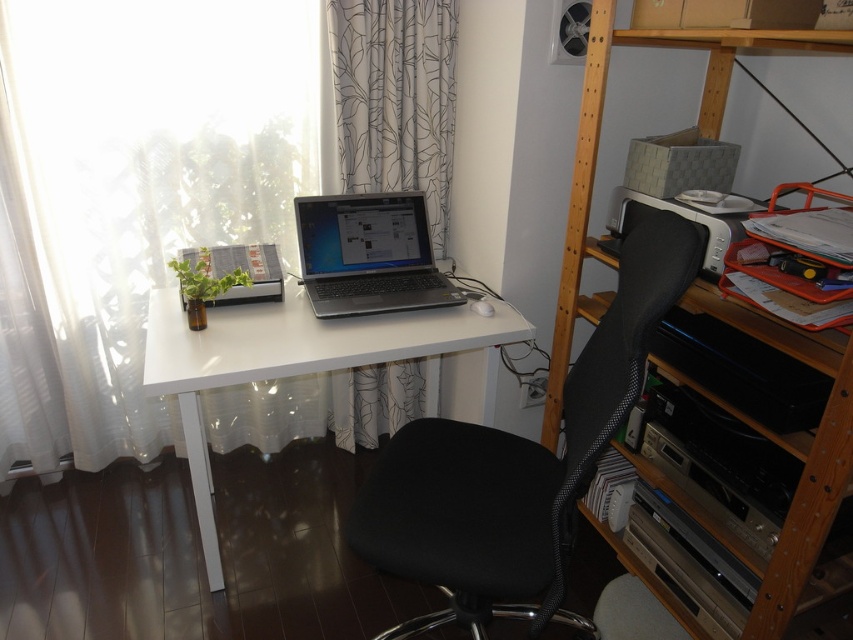
You are sitting in the black fabric swivel chair at center and want to reach the satin black laptop at center. Can you easily reach it without moving your chair?

The black fabric swivel chair at center is in front of the satin black laptop at center, so you can easily reach the laptop by leaning forward or swiveling slightly without needing to move the chair.

You are setting up a new desk in your home office. You have a black fabric swivel chair at center and a satin black laptop at center. Which object takes up more space on the desk?

The black fabric swivel chair at center is larger in size than the satin black laptop at center, so it takes up more space on the desk.

You are organizing a bookshelf and need to know the vertical distance between the white printed curtain at upper center and the wooden bookshelf at upper right. Can you determine which one is higher?

The white printed curtain at upper center is above the wooden bookshelf at upper right, so the curtain is higher.